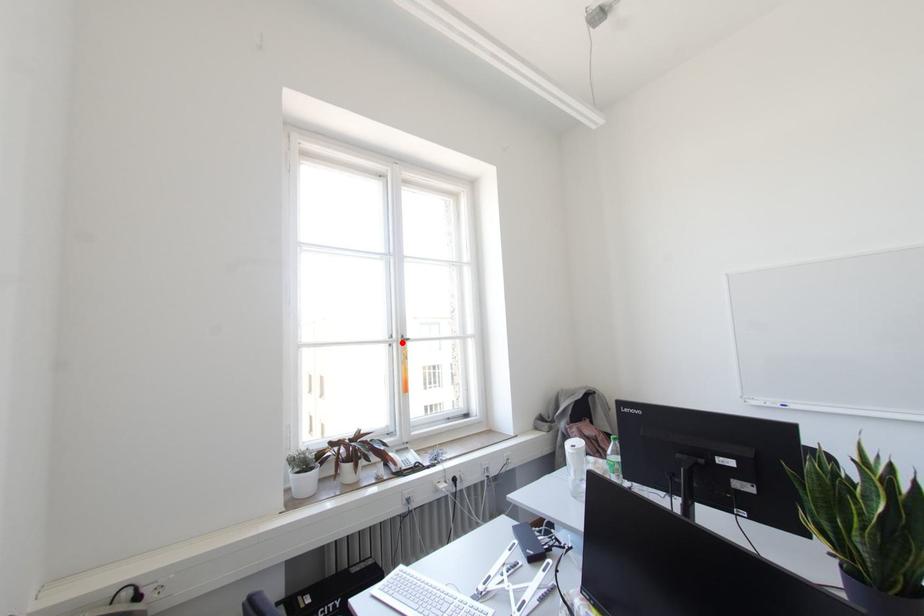
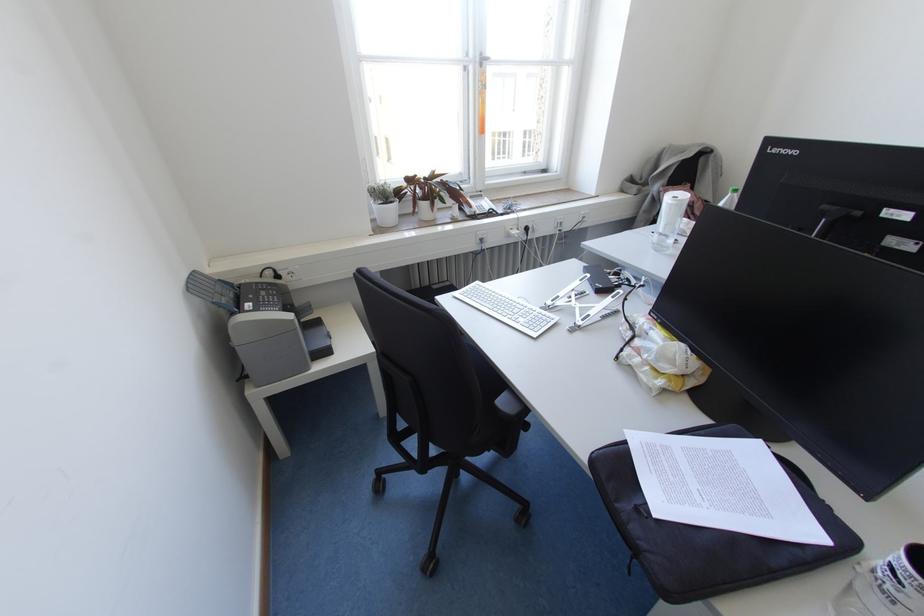
Locate, in the second image, the point that corresponds to the highlighted location in the first image.

(480, 65)